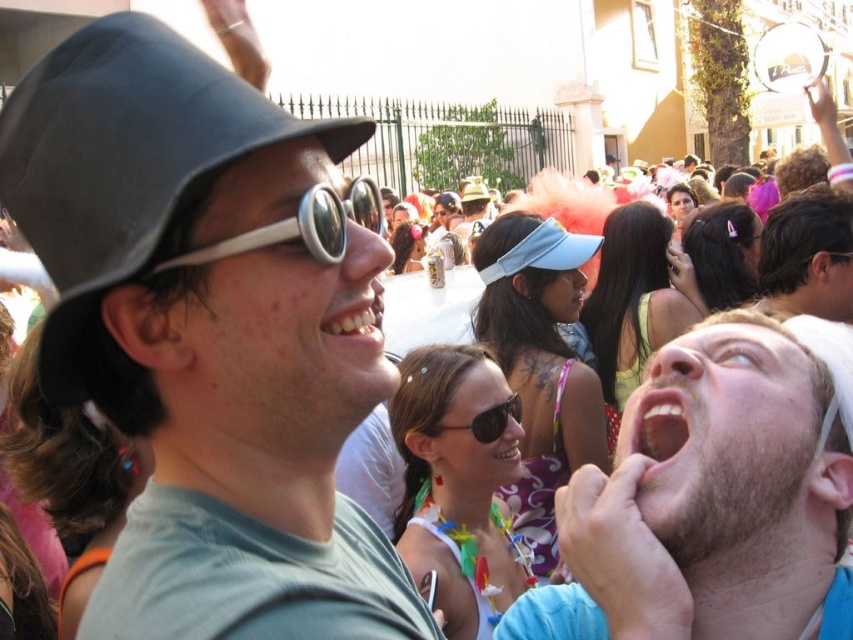
Can you confirm if smooth brown hair at center is positioned to the left of pink matte lips at lower right?

No, smooth brown hair at center is not to the left of pink matte lips at lower right.

In the scene shown: Is smooth brown hair at center in front of pink matte lips at lower right?

No.

Is point (764, 289) positioned after point (682, 422)?

Yes, it is.

At what (x,y) coordinates should I click in order to perform the action: click on smooth brown hair at center. Please return your answer as a coordinate pair (x, y). The width and height of the screenshot is (853, 640). Looking at the image, I should click on (808, 257).

Looking at this image, does beige fabric headband at upper right appear over bright white teeth at center?

Actually, beige fabric headband at upper right is below bright white teeth at center.

Is beige fabric headband at upper right below bright white teeth at center?

Correct, beige fabric headband at upper right is located below bright white teeth at center.

Who is more forward, (x=798, y=544) or (x=370, y=307)?

Point (x=798, y=544) is in front.

You are a GUI agent. You are given a task and a screenshot of the screen. Output one action in this format:
    pyautogui.click(x=<x>, y=<y>)
    Task: Click on the beige fabric headband at upper right
    The height and width of the screenshot is (640, 853).
    Given the screenshot: What is the action you would take?
    pyautogui.click(x=714, y=497)

Does sunglasses at center have a greater width compared to white glossy teeth at center?

Yes, sunglasses at center is wider than white glossy teeth at center.

Who is more forward, (x=492, y=419) or (x=509, y=445)?

Point (x=492, y=419)

Image resolution: width=853 pixels, height=640 pixels. I want to click on sunglasses at center, so click(x=489, y=420).